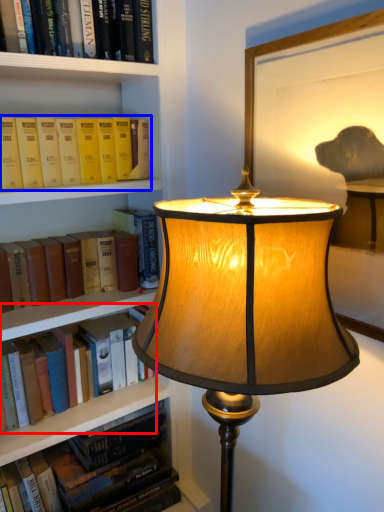
Question: Among these objects, which one is nearest to the camera, book (highlighted by a red box) or book (highlighted by a blue box)?

Choices:
 (A) book
 (B) book

Answer: (B)